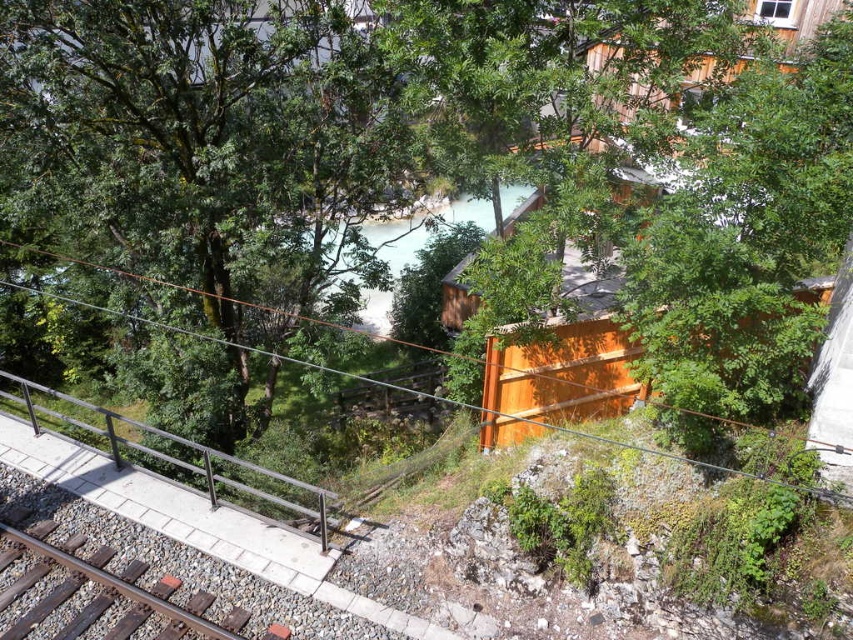
You are a bird flying over the scene and want to land on a spot that is both near the green leafy tree at center and the brown metal train track at lower left. Which object would you choose to land closer to, considering their sizes?

The green leafy tree at center has a larger size compared to the brown metal train track at lower left, so you should land closer to the green leafy tree at center to ensure a stable landing area.